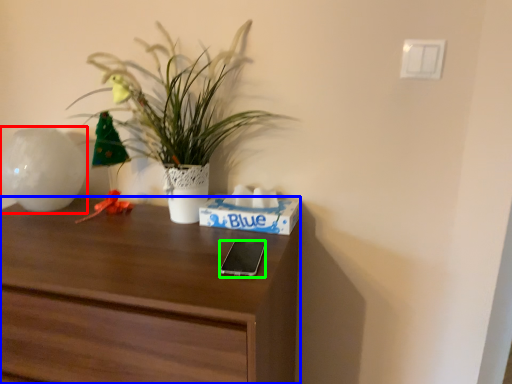
Question: Estimate the real-world distances between objects in this image. Which object is farther from vase (highlighted by a red box), desk (highlighted by a blue box) or mobile phone (highlighted by a green box)?

Choices:
 (A) desk
 (B) mobile phone

Answer: (B)